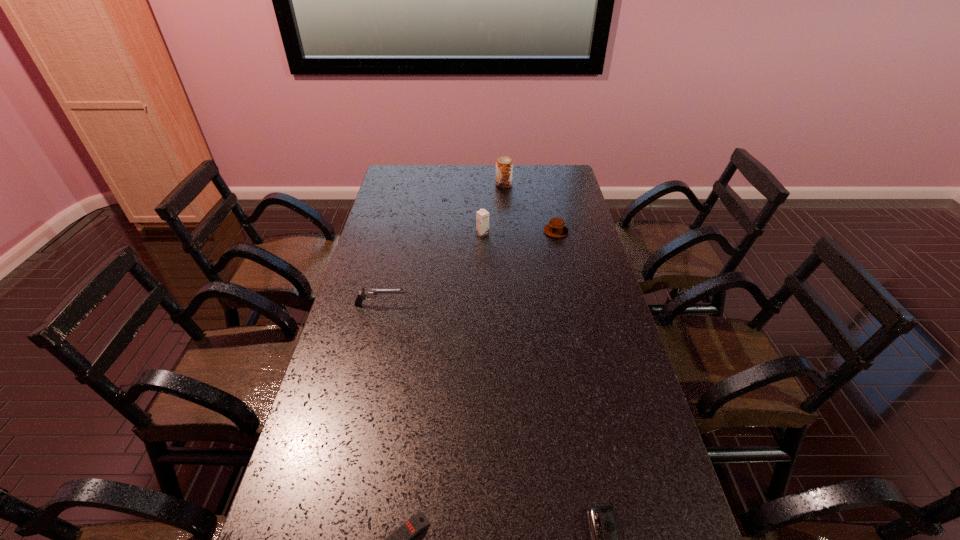
Locate an element on the screen. free space between the chocolate milk and the leftmost object is located at coordinates (432, 269).

Where is `vacant space that is in between the chocolate milk and the fourth tallest object`? vacant space that is in between the chocolate milk and the fourth tallest object is located at coordinates (519, 233).

The height and width of the screenshot is (540, 960). In order to click on vacant space in between the fifth shortest object and the fourth tallest object in this screenshot , I will do point(519,233).

Identify the location of vacant space that's between the chocolate milk and the fourth tallest object. Image resolution: width=960 pixels, height=540 pixels. (519, 233).

Identify which object is located as the second nearest to the fourth object from left to right. Please provide its 2D coordinates. Your answer should be formatted as a tuple, i.e. [(x, y)], where the tuple contains the x and y coordinates of a point satisfying the conditions above.

[(482, 216)]

You are a GUI agent. You are given a task and a screenshot of the screen. Output one action in this format:
    pyautogui.click(x=<x>, y=<y>)
    Task: Click on the fourth closest object to the shortest object
    This screenshot has height=540, width=960.
    Given the screenshot: What is the action you would take?
    pyautogui.click(x=555, y=228)

Locate an element on the screen. free spot that satisfies the following two spatial constraints: 1. on the front side of the muffin; 2. on the left side of the third object from right to left is located at coordinates (508, 231).